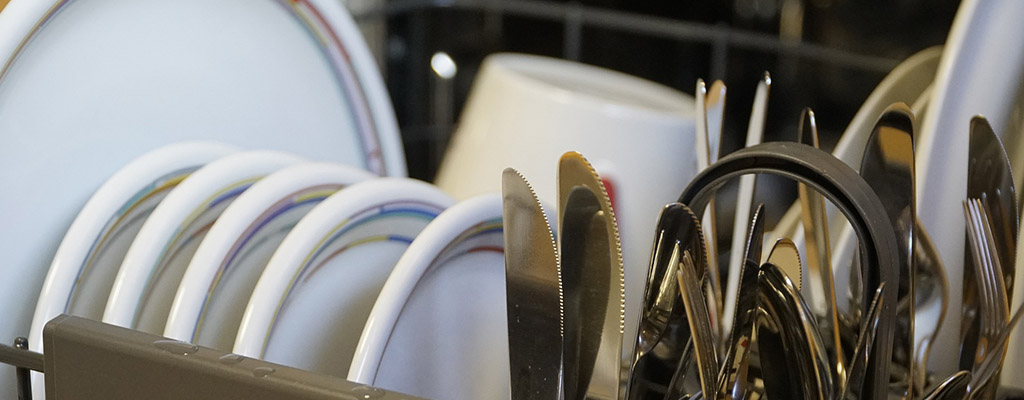
Find the location of a particular element. plates is located at coordinates (142, 198), (176, 218), (245, 244), (309, 273), (411, 299), (154, 82), (980, 100), (920, 100), (910, 88).